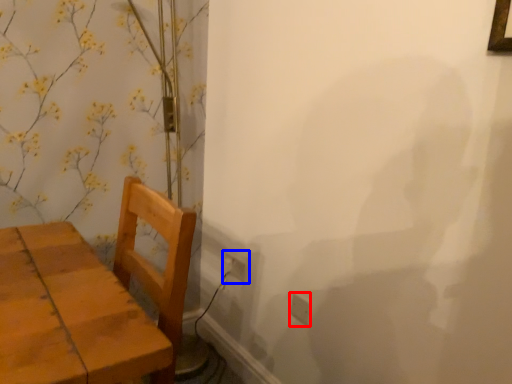
Question: Which object is closer to the camera taking this photo, electric outlet (highlighted by a red box) or electric outlet (highlighted by a blue box)?

Choices:
 (A) electric outlet
 (B) electric outlet

Answer: (A)